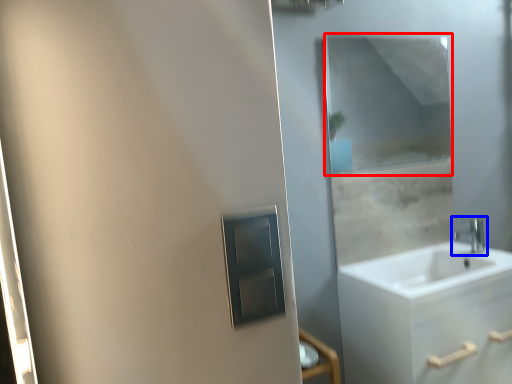
Question: Which object is closer to the camera taking this photo, mirror (highlighted by a red box) or tap (highlighted by a blue box)?

Choices:
 (A) mirror
 (B) tap

Answer: (A)